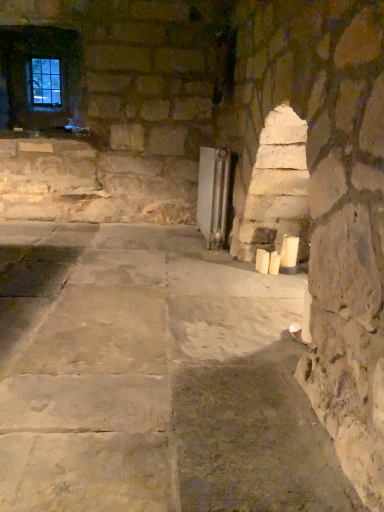
This screenshot has width=384, height=512. Find the location of `clear glass window at upper left`. clear glass window at upper left is located at coordinates (43, 82).

Identify the location of white wax candle at lower right, the second candle positioned from the left. The height and width of the screenshot is (512, 384). (274, 263).

Based on the photo, which of these two, clear glass window at upper left or white wax candle at lower right, the second candle positioned from the left, is smaller?

Smaller between the two is white wax candle at lower right, the second candle positioned from the left.

Is clear glass window at upper left positioned far away from white wax candle at lower right, the second candle positioned from the left?

That's right, there is a large distance between clear glass window at upper left and white wax candle at lower right, the second candle positioned from the left.

How many degrees apart are the facing directions of clear glass window at upper left and white wax candle at lower right, acting as the 2th candle starting from the right?

89.1 degrees separate the facing orientations of clear glass window at upper left and white wax candle at lower right, acting as the 2th candle starting from the right.

In the image, is clear glass window at upper left on the left side or the right side of white wax candle at lower right, the second candle positioned from the left?

In the image, clear glass window at upper left appears on the left side of white wax candle at lower right, the second candle positioned from the left.

From the image's perspective, who appears lower, clear glass window at upper left or white wax candle at right, the third candle positioned from the left?

white wax candle at right, the third candle positioned from the left, appears lower in the image.

Is white wax candle at right, the third candle positioned from the left, at the back of clear glass window at upper left?

No, clear glass window at upper left's orientation is not away from white wax candle at right, the third candle positioned from the left.

Which of these two, clear glass window at upper left or white wax candle at right, placed as the 1th candle when sorted from right to left, is bigger?

Bigger between the two is clear glass window at upper left.

Are clear glass window at upper left and white matte candle at center-right, the 1th candle viewed from the left, far apart?

clear glass window at upper left is positioned a significant distance from white matte candle at center-right, the 1th candle viewed from the left.

You are a GUI agent. You are given a task and a screenshot of the screen. Output one action in this format:
    pyautogui.click(x=<x>, y=<y>)
    Task: Click on the 2nd candle in front of the clear glass window at upper left
    
    Given the screenshot: What is the action you would take?
    pyautogui.click(x=262, y=261)

From the image's perspective, does clear glass window at upper left appear higher than white matte candle at center-right, which is counted as the 3th candle, starting from the right?

Indeed, from the image's perspective, clear glass window at upper left is shown above white matte candle at center-right, which is counted as the 3th candle, starting from the right.

Which is more distant, (x=57, y=62) or (x=265, y=254)?

The point (x=57, y=62) is farther.

Is white wax candle at lower right, acting as the 2th candle starting from the right, oriented away from clear glass window at upper left?

white wax candle at lower right, acting as the 2th candle starting from the right, does not have its back to clear glass window at upper left.

Is white wax candle at lower right, acting as the 2th candle starting from the right, shorter than clear glass window at upper left?

Correct, white wax candle at lower right, acting as the 2th candle starting from the right, is not as tall as clear glass window at upper left.

How different are the orientations of white wax candle at lower right, the second candle positioned from the left, and clear glass window at upper left in degrees?

They differ by 89.1 degrees in their facing directions.

Which of these two, white wax candle at lower right, the second candle positioned from the left, or clear glass window at upper left, is wider?

clear glass window at upper left.

Find the location of a particular element. candle above the white matte candle at center-right, which is counted as the 3th candle, starting from the right (from the image's perspective) is located at coordinates (289, 251).

Is white wax candle at right, the third candle positioned from the left, at the back of white matte candle at center-right, which is counted as the 3th candle, starting from the right?

Yes, white matte candle at center-right, which is counted as the 3th candle, starting from the right, is positioned with its back facing white wax candle at right, the third candle positioned from the left.

Are white matte candle at center-right, which is counted as the 3th candle, starting from the right, and white wax candle at right, the third candle positioned from the left, located far from each other?

That's not correct — white matte candle at center-right, which is counted as the 3th candle, starting from the right, is a little close to white wax candle at right, the third candle positioned from the left.

From a real-world perspective, is white matte candle at center-right, which is counted as the 3th candle, starting from the right, above or below white wax candle at right, placed as the 1th candle when sorted from right to left?

Clearly, from a real-world perspective, white matte candle at center-right, which is counted as the 3th candle, starting from the right, is below white wax candle at right, placed as the 1th candle when sorted from right to left.

Which is farther from the camera, (285, 261) or (37, 88)?

Positioned behind is point (37, 88).

Image resolution: width=384 pixels, height=512 pixels. In order to click on the 3rd candle in front of the clear glass window at upper left in this screenshot , I will do `click(289, 251)`.

Is white wax candle at right, the third candle positioned from the left, positioned before clear glass window at upper left?

Yes, white wax candle at right, the third candle positioned from the left, is closer to the camera.

Who is smaller, white wax candle at right, the third candle positioned from the left, or clear glass window at upper left?

Smaller between the two is white wax candle at right, the third candle positioned from the left.

Is white wax candle at right, the third candle positioned from the left, oriented towards white wax candle at lower right, the second candle positioned from the left?

Yes, white wax candle at right, the third candle positioned from the left, faces towards white wax candle at lower right, the second candle positioned from the left.

Do you think white wax candle at right, the third candle positioned from the left, is within white wax candle at lower right, acting as the 2th candle starting from the right, or outside of it?

white wax candle at right, the third candle positioned from the left, lies outside white wax candle at lower right, acting as the 2th candle starting from the right.

Consider the image. How far apart are white wax candle at right, placed as the 1th candle when sorted from right to left, and white wax candle at lower right, acting as the 2th candle starting from the right?

white wax candle at right, placed as the 1th candle when sorted from right to left, and white wax candle at lower right, acting as the 2th candle starting from the right, are 2.87 inches apart from each other.

Locate an element on the screen. window that appears above the white wax candle at lower right, acting as the 2th candle starting from the right (from a real-world perspective) is located at coordinates (43, 82).

Locate an element on the screen. The height and width of the screenshot is (512, 384). window above the white wax candle at right, the third candle positioned from the left (from the image's perspective) is located at coordinates (43, 82).

Which object lies nearer to the anchor point white wax candle at right, placed as the 1th candle when sorted from right to left, white matte candle at center-right, the 1th candle viewed from the left, or clear glass window at upper left?

white matte candle at center-right, the 1th candle viewed from the left, is closer to white wax candle at right, placed as the 1th candle when sorted from right to left.

Considering their positions, is clear glass window at upper left positioned closer to white matte candle at center-right, the 1th candle viewed from the left, than white wax candle at lower right, acting as the 2th candle starting from the right?

white wax candle at lower right, acting as the 2th candle starting from the right, is positioned closer to the anchor white matte candle at center-right, the 1th candle viewed from the left.

Estimate the real-world distances between objects in this image. Which object is further from white wax candle at lower right, acting as the 2th candle starting from the right, clear glass window at upper left or white wax candle at right, the third candle positioned from the left?

clear glass window at upper left.

Considering their positions, is white wax candle at lower right, acting as the 2th candle starting from the right, positioned further to white wax candle at right, placed as the 1th candle when sorted from right to left, than clear glass window at upper left?

clear glass window at upper left is further to white wax candle at right, placed as the 1th candle when sorted from right to left.

Looking at the image, which one is located further to white matte candle at center-right, the 1th candle viewed from the left, white wax candle at right, the third candle positioned from the left, or white wax candle at lower right, the second candle positioned from the left?

white wax candle at right, the third candle positioned from the left, is further to white matte candle at center-right, the 1th candle viewed from the left.

Considering their positions, is white wax candle at right, placed as the 1th candle when sorted from right to left, positioned further to clear glass window at upper left than white matte candle at center-right, which is counted as the 3th candle, starting from the right?

white wax candle at right, placed as the 1th candle when sorted from right to left, lies further to clear glass window at upper left than the other object.

Which object lies further to the anchor point clear glass window at upper left, white matte candle at center-right, the 1th candle viewed from the left, or white wax candle at right, placed as the 1th candle when sorted from right to left?

white wax candle at right, placed as the 1th candle when sorted from right to left, lies further to clear glass window at upper left than the other object.

When comparing their distances from white matte candle at center-right, the 1th candle viewed from the left, does white wax candle at right, placed as the 1th candle when sorted from right to left, or clear glass window at upper left seem further?

clear glass window at upper left lies further to white matte candle at center-right, the 1th candle viewed from the left, than the other object.

Identify the location of candle between white matte candle at center-right, the 1th candle viewed from the left, and white wax candle at right, placed as the 1th candle when sorted from right to left, in the horizontal direction. The image size is (384, 512). (274, 263).

Identify the location of candle between clear glass window at upper left and white wax candle at lower right, acting as the 2th candle starting from the right, in the horizontal direction. This screenshot has width=384, height=512. (262, 261).